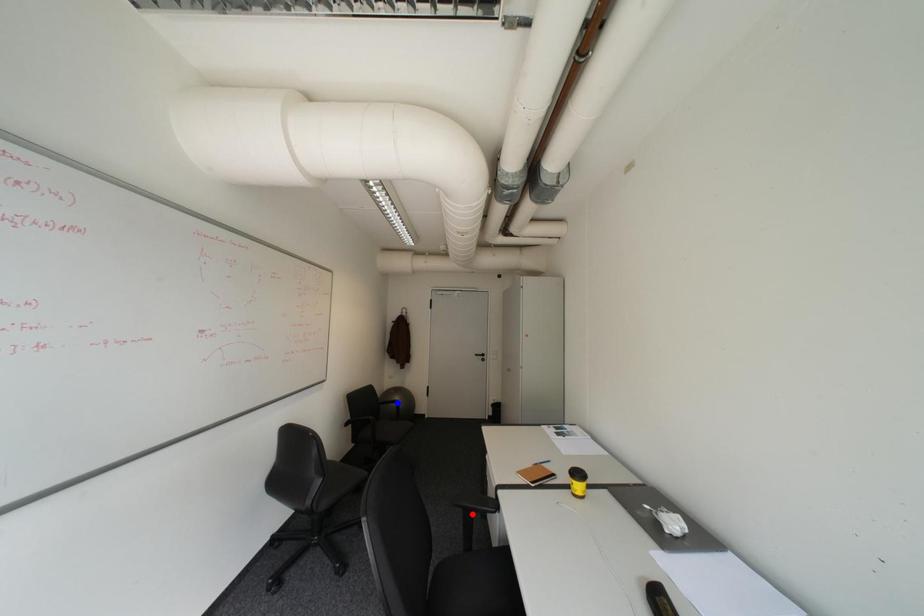
Question: Two points are marked on the image. Which point is closer to the camera?

Choices:
 (A) Blue point is closer.
 (B) Red point is closer.

Answer: (B)